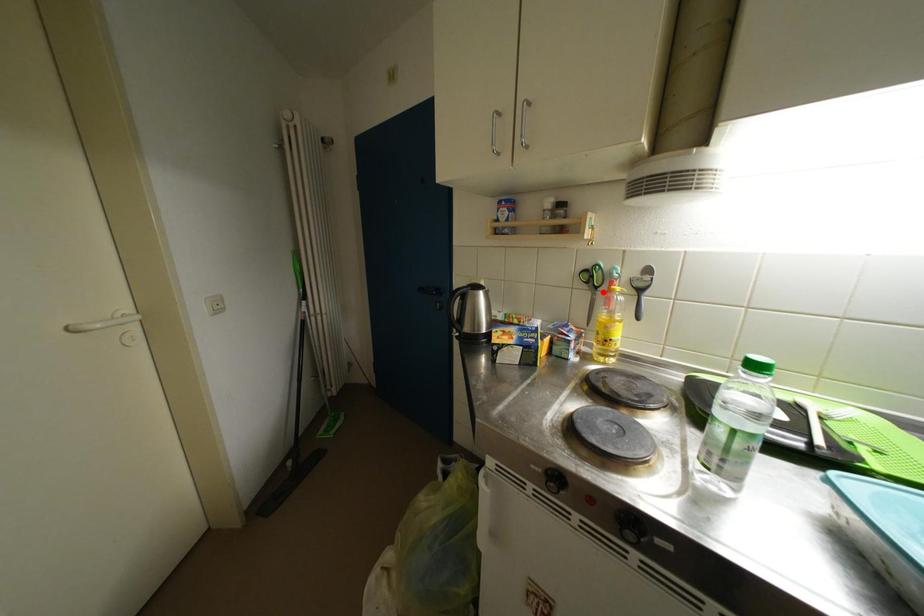
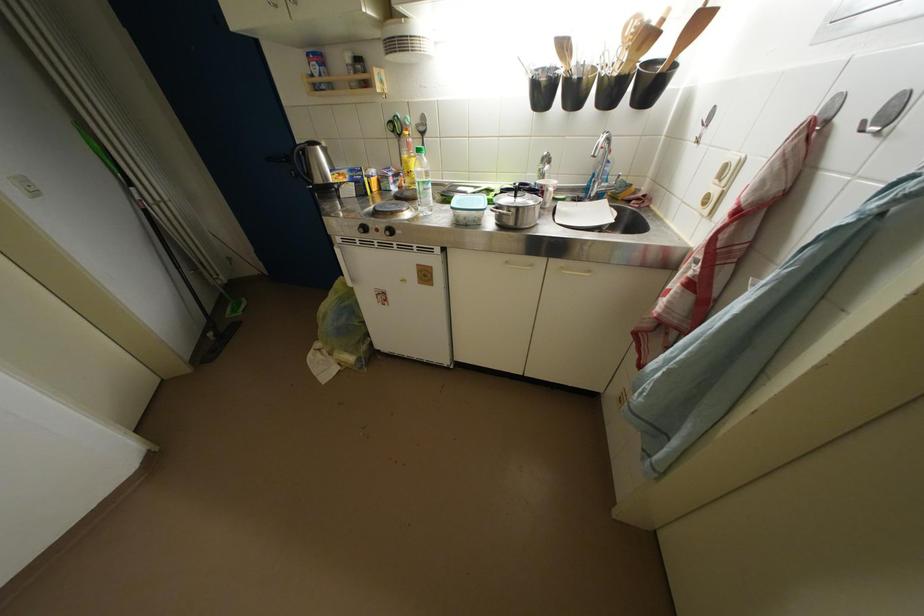
Where in the second image is the point corresponding to the highlighted location from the first image?

(407, 140)